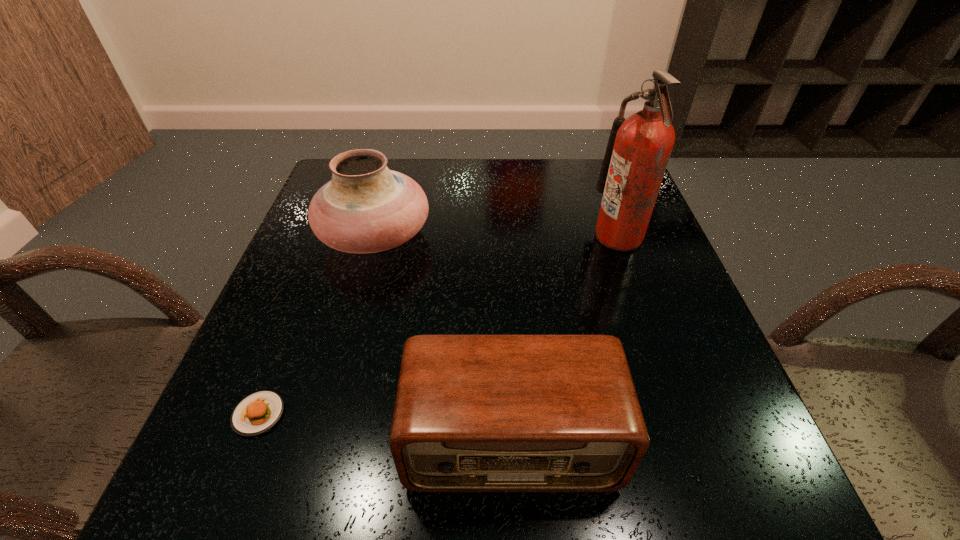
Where is `free space located 0.200m on the back of the shortest object`? The width and height of the screenshot is (960, 540). free space located 0.200m on the back of the shortest object is located at coordinates (301, 303).

The height and width of the screenshot is (540, 960). Identify the location of object located in the far edge section of the desktop. (366, 208).

Where is `object at the near edge`? This screenshot has height=540, width=960. object at the near edge is located at coordinates (473, 413).

Identify the location of pottery that is at the left edge. The image size is (960, 540). (366, 208).

I want to click on food located in the left edge section of the desktop, so click(x=258, y=412).

Where is `object located in the right edge section of the desktop`? The width and height of the screenshot is (960, 540). object located in the right edge section of the desktop is located at coordinates (638, 150).

Locate an element on the screen. object that is at the far left corner is located at coordinates (366, 208).

What are the coordinates of `vacant area at the far edge of the desktop` in the screenshot? It's located at (533, 179).

Where is `vacant space at the left edge of the desktop`? The height and width of the screenshot is (540, 960). vacant space at the left edge of the desktop is located at coordinates (301, 247).

At what (x,y) coordinates should I click in order to perform the action: click on vacant space at the right edge of the desktop. Please return your answer as a coordinate pair (x, y). This screenshot has height=540, width=960. Looking at the image, I should click on (618, 269).